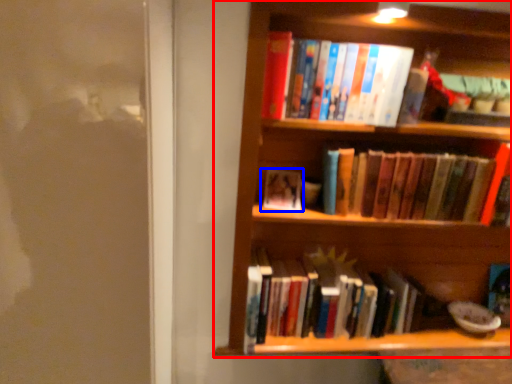
Question: Which of the following is the closest to the observer, shelf (highlighted by a red box) or book (highlighted by a blue box)?

Choices:
 (A) shelf
 (B) book

Answer: (A)